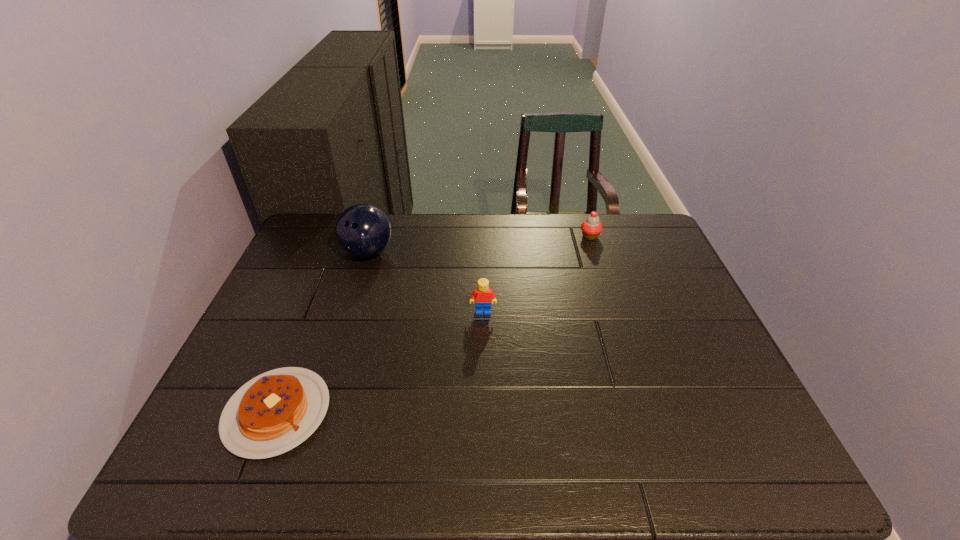
In the image, there is a desktop. Find the location of `free region at the right edge`. free region at the right edge is located at coordinates (704, 319).

In the image, there is a desktop. Identify the location of vacant space at the far left corner. The height and width of the screenshot is (540, 960). (333, 250).

Where is `empty space that is in between the Lego and the rightmost object`? The image size is (960, 540). empty space that is in between the Lego and the rightmost object is located at coordinates (537, 274).

Identify the location of free spot between the rightmost object and the second object from right to left. Image resolution: width=960 pixels, height=540 pixels. (537, 274).

Where is `free point between the tallest object and the third farthest object`? The width and height of the screenshot is (960, 540). free point between the tallest object and the third farthest object is located at coordinates (425, 282).

This screenshot has height=540, width=960. Identify the location of vacant area that lies between the second shortest object and the bowling ball. click(x=479, y=245).

Locate an element on the screen. Image resolution: width=960 pixels, height=540 pixels. vacant space that's between the bowling ball and the pancake is located at coordinates (323, 333).

What are the coordinates of `unoccupied area between the second shortest object and the second object from right to left` in the screenshot? It's located at (537, 274).

Locate an element on the screen. The width and height of the screenshot is (960, 540). free space between the Lego and the rightmost object is located at coordinates (537, 274).

You are a GUI agent. You are given a task and a screenshot of the screen. Output one action in this format:
    pyautogui.click(x=<x>, y=<y>)
    Task: Click on the free space between the second nearest object and the third tallest object
    
    Given the screenshot: What is the action you would take?
    pyautogui.click(x=537, y=274)